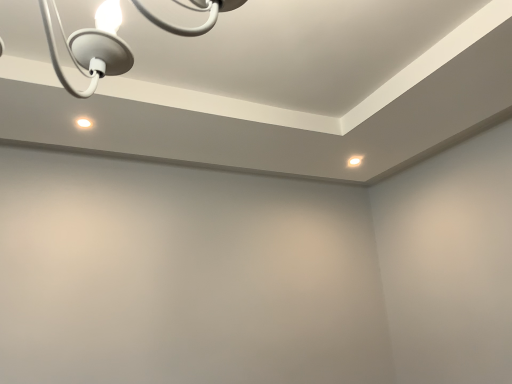
What is the approximate height of white glossy droplight at upper right?

white glossy droplight at upper right is 0.53 inches tall.

Image resolution: width=512 pixels, height=384 pixels. What do you see at coordinates (355, 161) in the screenshot?
I see `white glossy droplight at upper right` at bounding box center [355, 161].

The image size is (512, 384). Find the location of `white glossy droplight at upper right`. white glossy droplight at upper right is located at coordinates (355, 161).

Measure the distance between white glossy droplight at upper right and camera.

white glossy droplight at upper right and camera are 2.51 meters apart from each other.

This screenshot has height=384, width=512. I want to click on white glossy droplight at upper right, so click(355, 161).